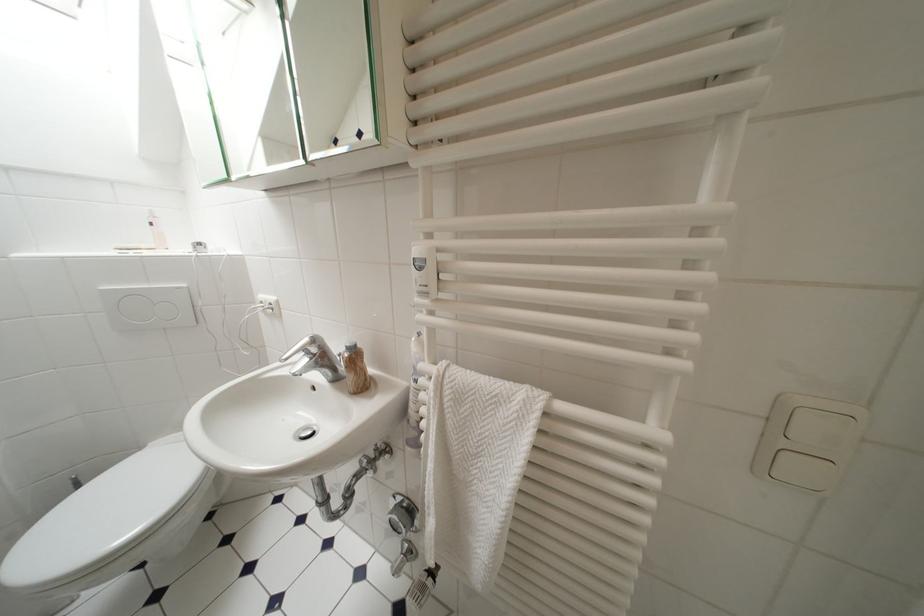
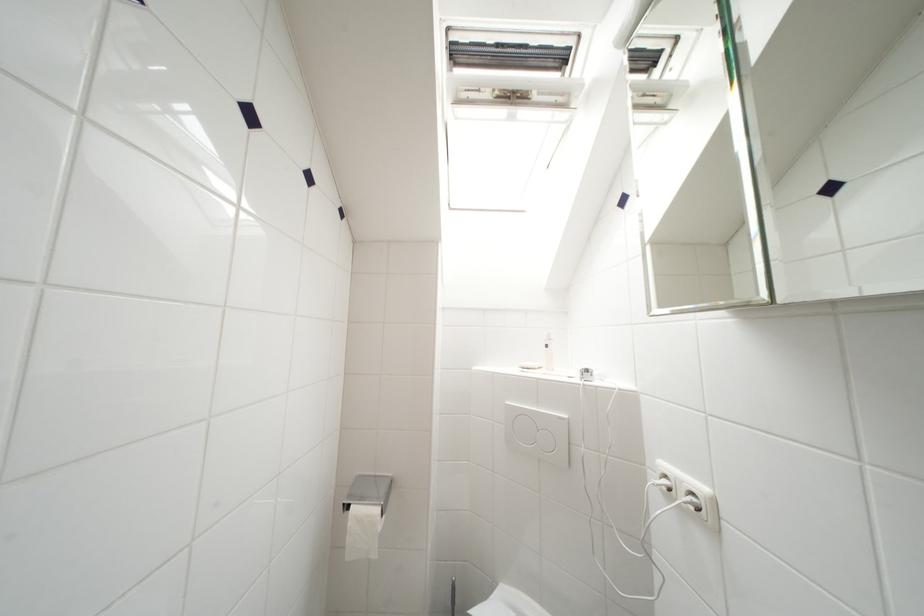
Locate, in the second image, the point that corresponds to [277,307] in the first image.

(699, 498)